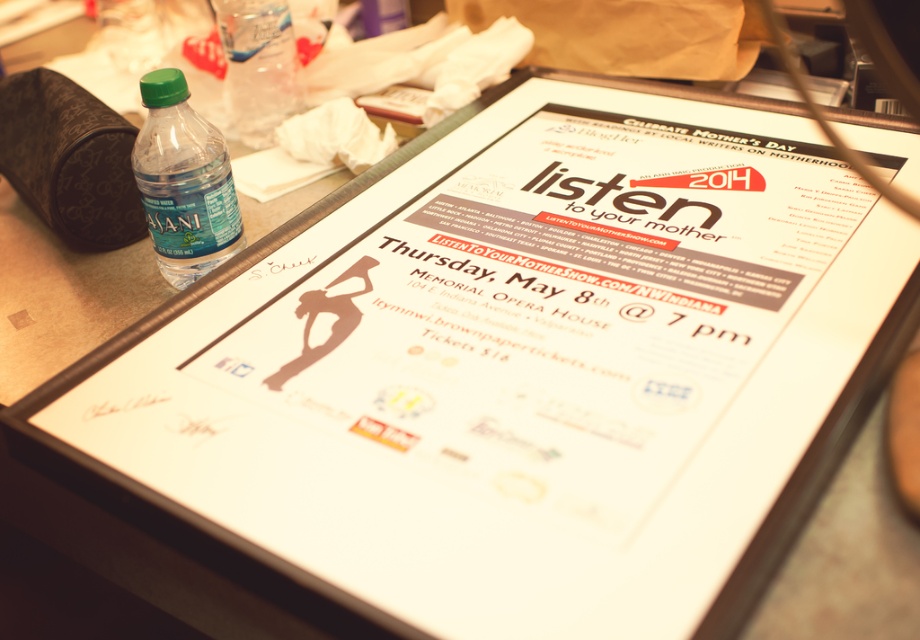
Identify the location of green matte plastic bottle at left. The height and width of the screenshot is (640, 920). (184, 182).